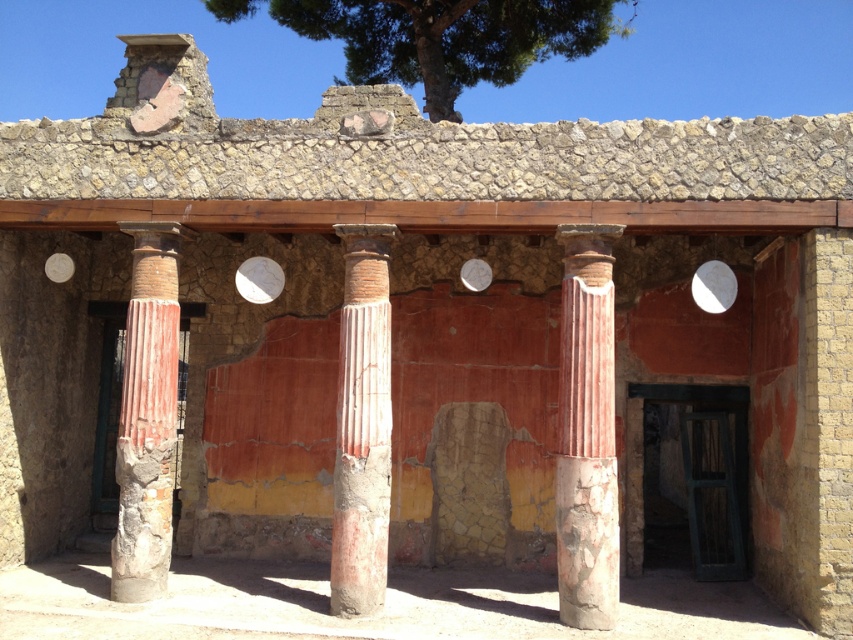
Does green leafy tree at upper center appear on the left side of reddish-brown stone column at left?

In fact, green leafy tree at upper center is to the right of reddish-brown stone column at left.

Identify the location of green leafy tree at upper center. The height and width of the screenshot is (640, 853). (444, 36).

Is point (393, 80) positioned before point (128, 342)?

No, (393, 80) is behind (128, 342).

You are a GUI agent. You are given a task and a screenshot of the screen. Output one action in this format:
    pyautogui.click(x=<x>, y=<y>)
    Task: Click on the green leafy tree at upper center
    
    Given the screenshot: What is the action you would take?
    pyautogui.click(x=444, y=36)

Who is more forward, [374,33] or [360,248]?

Point [360,248]

Does green leafy tree at upper center appear on the left side of smooth terracotta column at center?

Incorrect, green leafy tree at upper center is not on the left side of smooth terracotta column at center.

Which is in front, point (523, 16) or point (364, 580)?

Point (364, 580) is in front.

Identify the location of green leafy tree at upper center. (444, 36).

Can you confirm if red marble column at center is positioned to the right of reddish-brown stone column at left?

Correct, you'll find red marble column at center to the right of reddish-brown stone column at left.

In the scene shown: Does red marble column at center appear under reddish-brown stone column at left?

Indeed, red marble column at center is positioned under reddish-brown stone column at left.

Who is more distant from viewer, (579, 589) or (135, 412)?

The point (135, 412) is more distant.

Locate an element on the screen. red marble column at center is located at coordinates (585, 433).